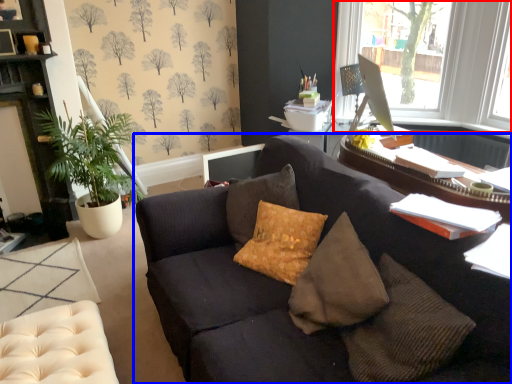
Question: Which of the following is the farthest to the observer, window (highlighted by a red box) or studio couch (highlighted by a blue box)?

Choices:
 (A) window
 (B) studio couch

Answer: (A)